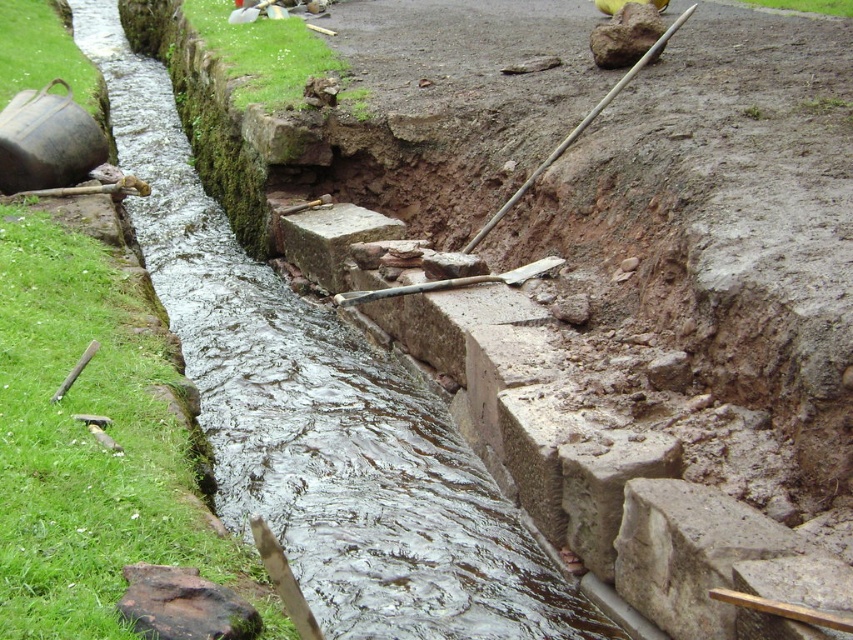
You are a construction worker who needs to cross the wet concrete stream at center to retrieve the wooden shovel at center. Can you safely step over the stream without getting your boots wet?

The wet concrete stream at center is closer to the viewer than the wooden shovel at center, so stepping over the stream would require crossing it before reaching the shovel. However, since the stream is made of wet concrete, it might not be solid enough to step on. Wait for the concrete to dry before attempting to cross.

You are a construction worker who needs to cross the wet concrete stream at center to reach the smooth wooden shovel at upper right. Is the shovel accessible from your current position without stepping into the stream?

The wet concrete stream at center is in front of the smooth wooden shovel at upper right, meaning the shovel is behind the stream. To reach it, you would need to cross the stream. Therefore, the shovel is not accessible without stepping into the stream.

You are a construction worker who needs to cross the wet concrete stream at center to retrieve the wooden shovel at center. Can you safely walk across the stream to get the shovel?

The wet concrete stream at center is bigger than the wooden shovel at center, so the stream is wider than the shovel. Since the stream is wider, it may be difficult to cross safely without proper equipment. It is recommended to find another way or wait until the concrete dries.